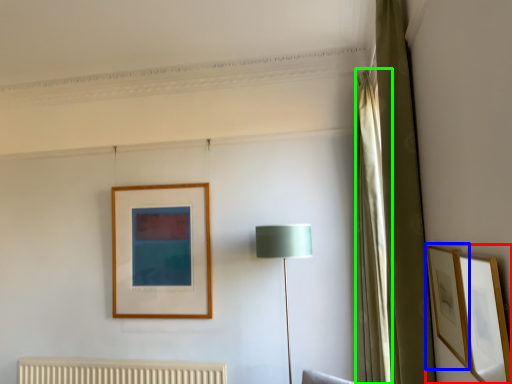
Question: Considering the real-world distances, which object is closest to picture frame (highlighted by a red box)? picture frame (highlighted by a blue box) or curtain (highlighted by a green box).

Choices:
 (A) picture frame
 (B) curtain

Answer: (A)